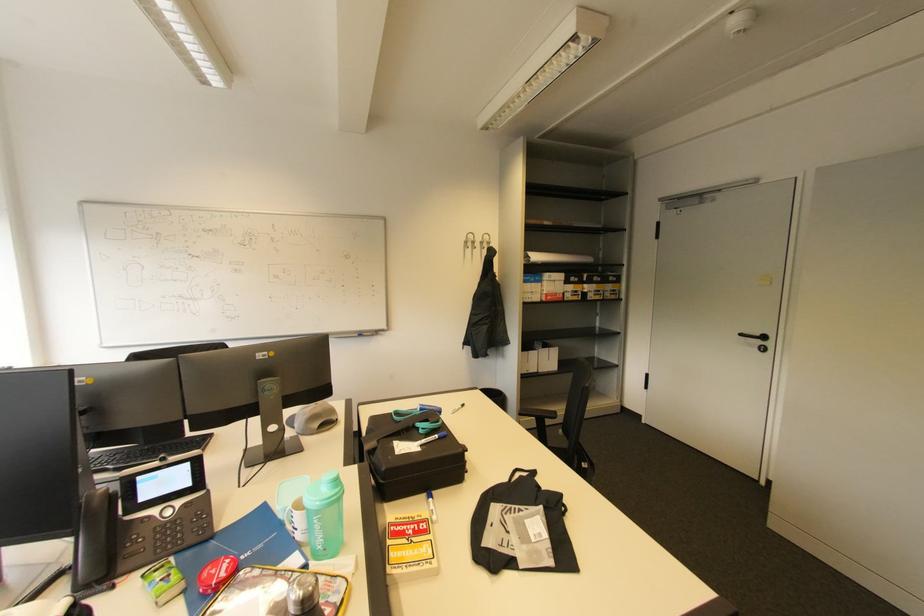
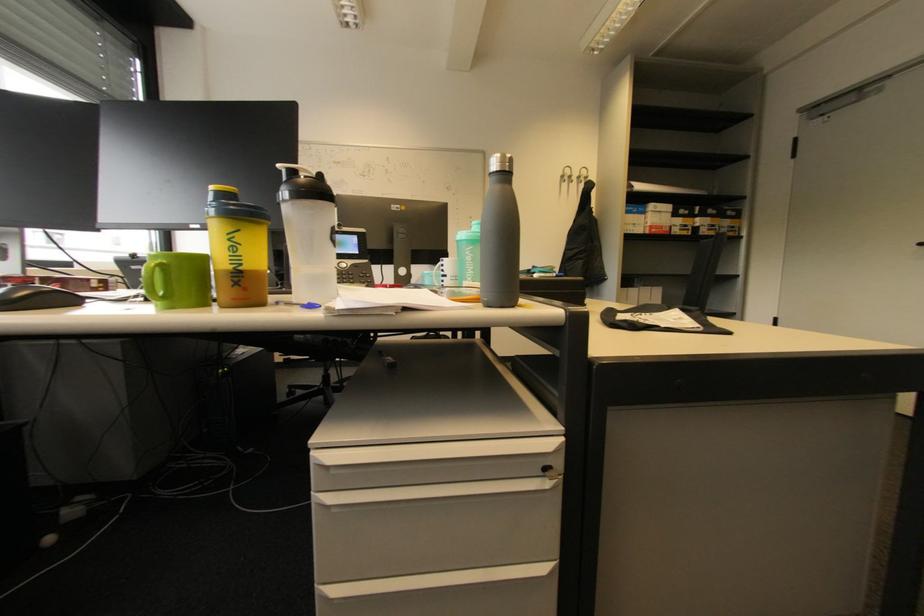
The point at (487, 244) is marked in the first image. Where is the corresponding point in the second image?

(584, 177)